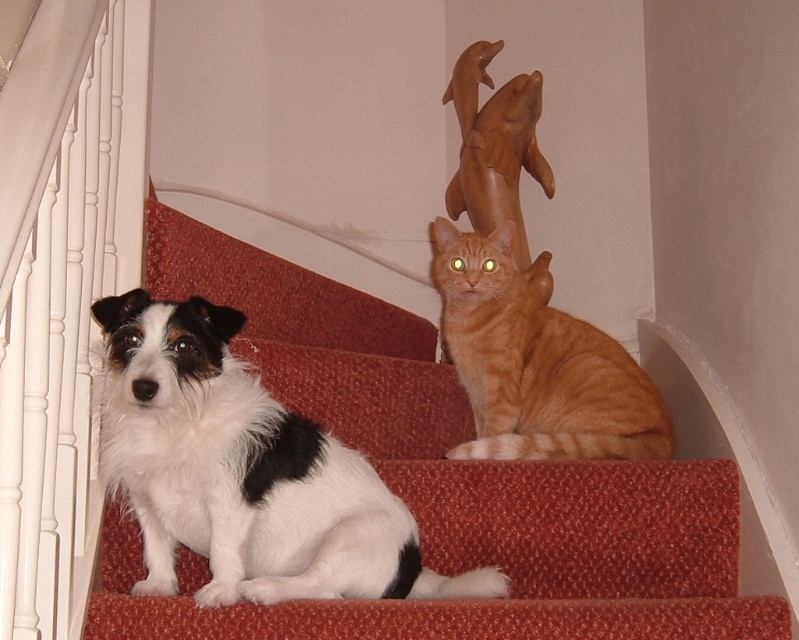
Consider the image. You are standing at the base of the staircase and want to place a small decoration between the two points marked as point (62,360) and point (173,564). Which point should you place it closer to so that it appears closer to you?

You should place the decoration closer to point (62,360) because it is closer to the viewer than point (173,564).